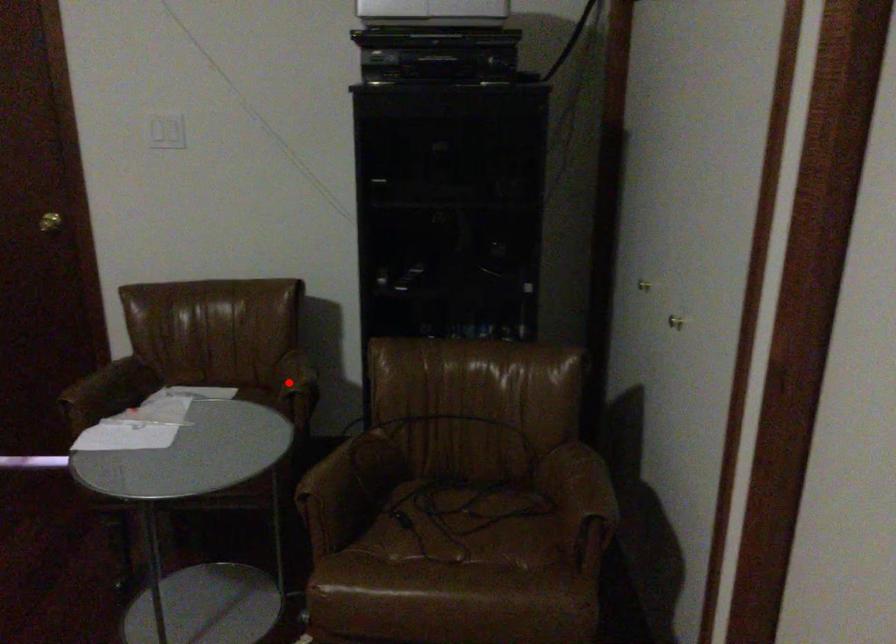
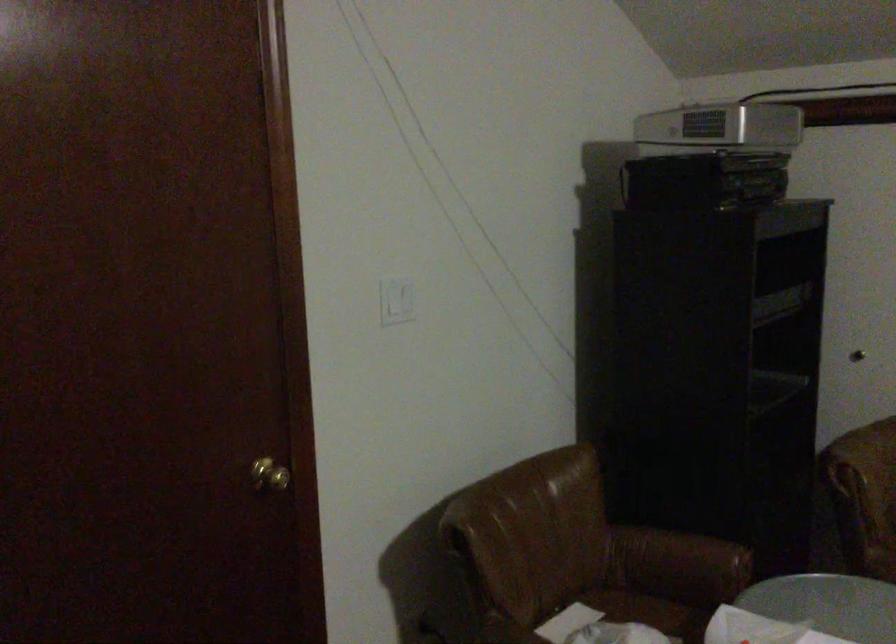
Question: I am providing you with two images of the same scene from different viewpoints. Given a red point in image1, look at the same physical point in image2. Is it:

Choices:
 (A) Closer to the viewpoint
 (B) Farther from the viewpoint

Answer: (A)